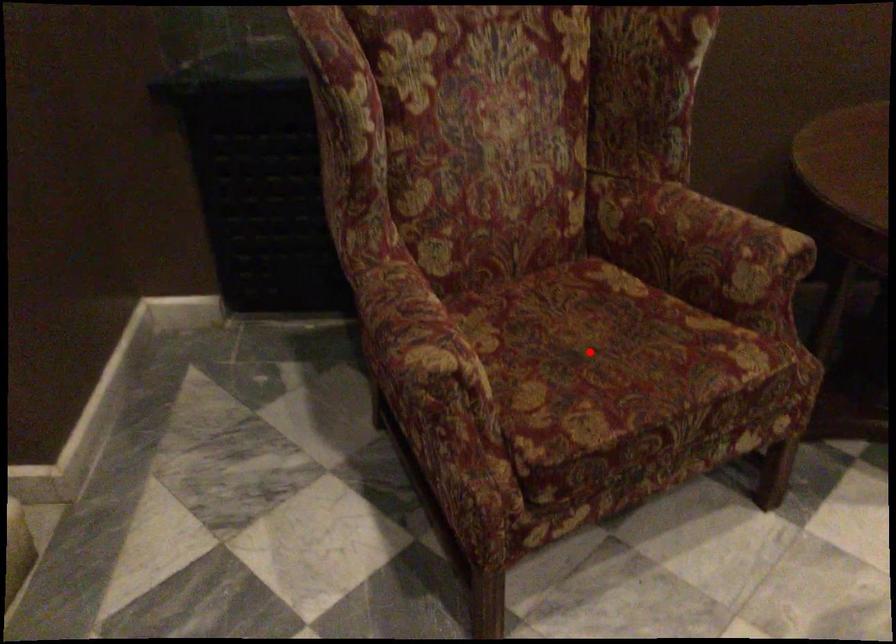
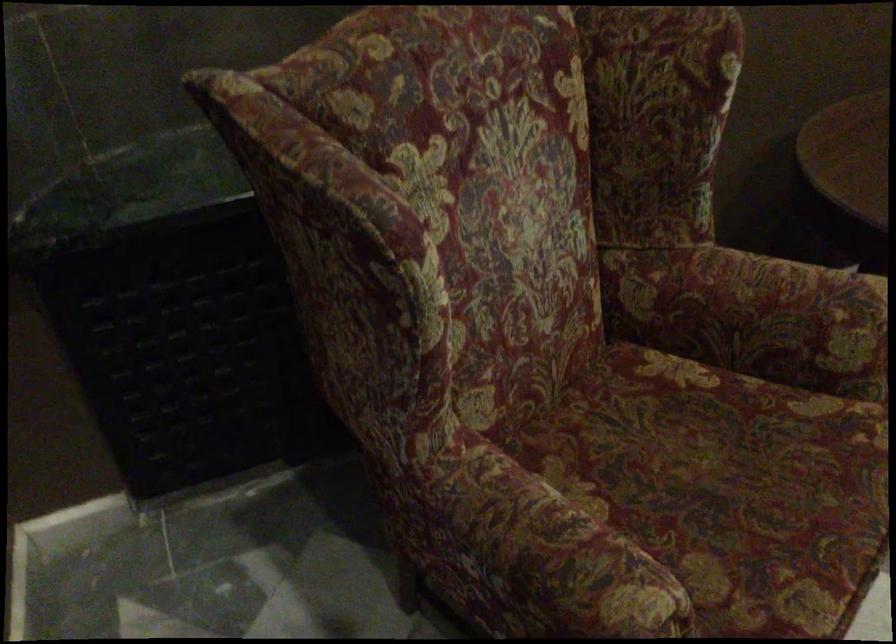
Locate, in the second image, the point that corresponds to the highlighted location in the first image.

(726, 486)